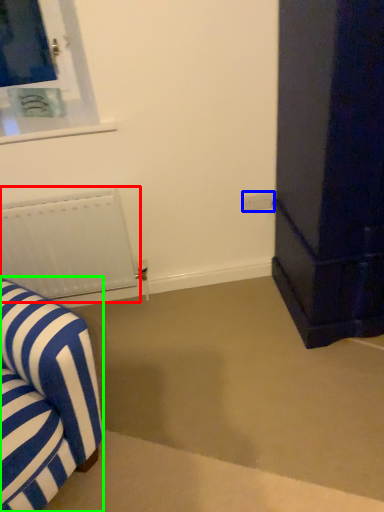
Question: Which object is positioned closest to radiator (highlighted by a red box)? Select from electric outlet (highlighted by a blue box) and furniture (highlighted by a green box).

Choices:
 (A) electric outlet
 (B) furniture

Answer: (B)